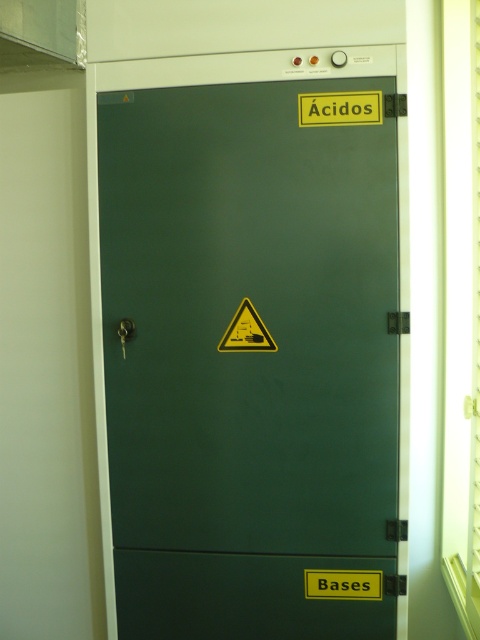
You are a lab technician who needs to identify the largest object between the green matte cabinet at center and the yellow triangular warning sign at center in the image. Which one should you choose?

The green matte cabinet at center is bigger than the yellow triangular warning sign at center, so you should choose the green matte cabinet at center.